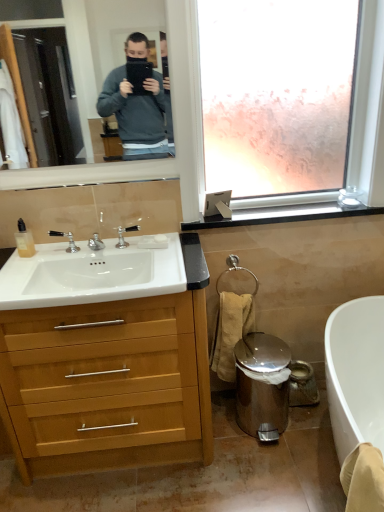
Locate an element on the screen. free space to the left of polished stainless steel trash can at lower right is located at coordinates (221, 436).